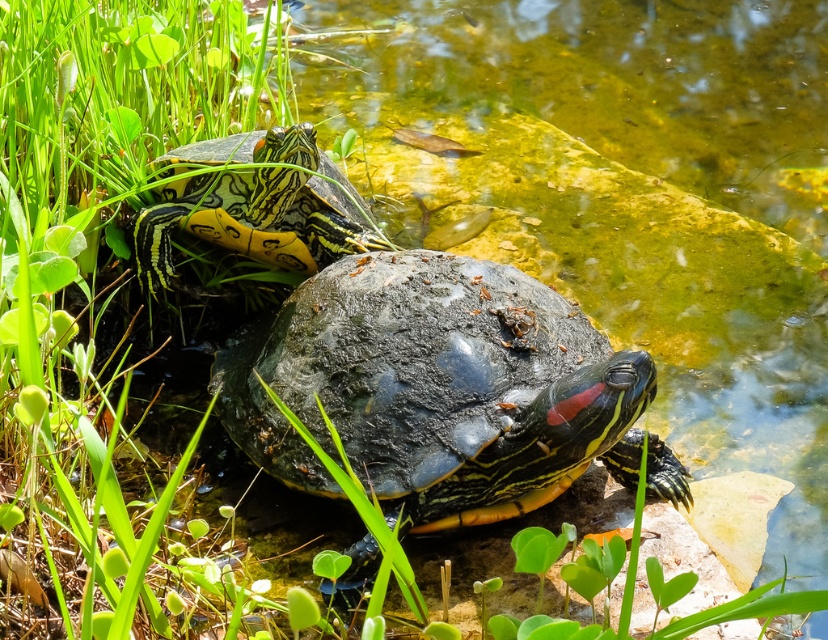
Question: Which point is closer to the camera?

Choices:
 (A) yellow-green painted shell at upper left
 (B) shiny black tortoise at center

Answer: (B)

Question: Can you confirm if shiny black tortoise at center is smaller than yellow-green painted shell at upper left?

Choices:
 (A) no
 (B) yes

Answer: (A)

Question: Which point is farther to the camera?

Choices:
 (A) yellow-green painted shell at upper left
 (B) shiny black tortoise at center

Answer: (A)

Question: Does shiny black tortoise at center have a greater width compared to yellow-green painted shell at upper left?

Choices:
 (A) no
 (B) yes

Answer: (B)

Question: Is shiny black tortoise at center positioned in front of yellow-green painted shell at upper left?

Choices:
 (A) yes
 (B) no

Answer: (A)